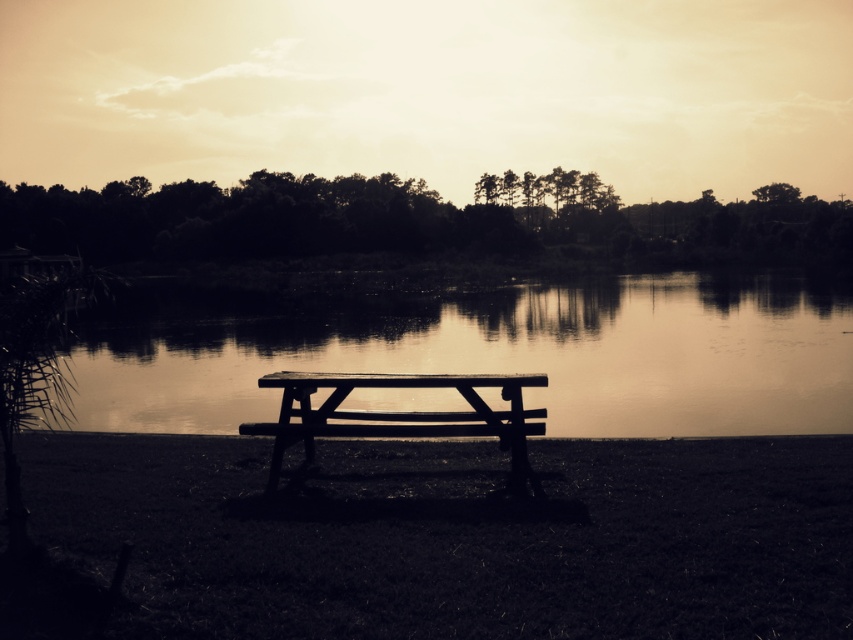
Question: Which of the following is the farthest from the observer?

Choices:
 (A) (308, 396)
 (B) (757, 324)

Answer: (B)

Question: Among these points, which one is nearest to the camera?

Choices:
 (A) (369, 387)
 (B) (236, 332)

Answer: (A)

Question: Considering the relative positions of smooth water at bench left and wooden bench at center in the image provided, where is smooth water at bench left located with respect to wooden bench at center?

Choices:
 (A) right
 (B) left

Answer: (A)

Question: Can you confirm if smooth water at bench left is wider than wooden bench at center?

Choices:
 (A) yes
 (B) no

Answer: (A)

Question: Is smooth water at bench left above wooden bench at center?

Choices:
 (A) no
 (B) yes

Answer: (B)